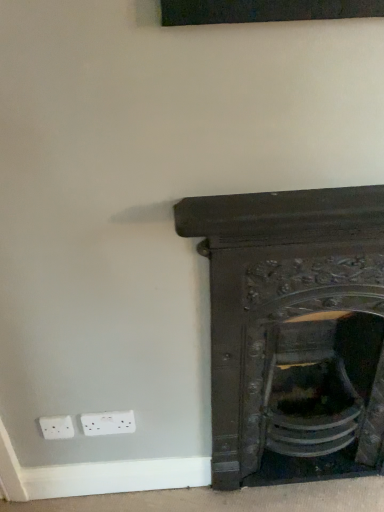
You are a GUI agent. You are given a task and a screenshot of the screen. Output one action in this format:
    pyautogui.click(x=<x>, y=<y>)
    Task: Click on the white plastic electric outlet at lower left
    The image size is (384, 512).
    Given the screenshot: What is the action you would take?
    pyautogui.click(x=108, y=423)

What do you see at coordinates (108, 423) in the screenshot? I see `white plastic electric outlet at lower left` at bounding box center [108, 423].

At what (x,y) coordinates should I click in order to perform the action: click on dark wood fireplace at lower right. Please return your answer as a coordinate pair (x, y). The image size is (384, 512). Looking at the image, I should click on (293, 331).

In order to face dark wood fireplace at lower right, should I rotate leftwards or rightwards?

A 15.971 degree turn to the right will do.

The width and height of the screenshot is (384, 512). What do you see at coordinates (293, 331) in the screenshot? I see `dark wood fireplace at lower right` at bounding box center [293, 331].

This screenshot has height=512, width=384. Identify the location of white plastic electric outlet at lower left. (108, 423).

Considering the positions of objects dark wood fireplace at lower right and white plastic electric outlet at lower left in the image provided, who is more to the right, dark wood fireplace at lower right or white plastic electric outlet at lower left?

Positioned to the right is dark wood fireplace at lower right.

Which object is further away from the camera taking this photo, dark wood fireplace at lower right or white plastic electric outlet at lower left?

white plastic electric outlet at lower left.

Considering the points (333, 292) and (110, 417), which point is in front, point (333, 292) or point (110, 417)?

The point (333, 292) is more forward.

From the image's perspective, would you say dark wood fireplace at lower right is shown under white plastic electric outlet at lower left?

Actually, dark wood fireplace at lower right appears above white plastic electric outlet at lower left in the image.

From a real-world perspective, relative to white plastic electric outlet at lower left, is dark wood fireplace at lower right vertically above or below?

In terms of real-world spatial position, dark wood fireplace at lower right is above white plastic electric outlet at lower left.

Is dark wood fireplace at lower right wider or thinner than white plastic electric outlet at lower left?

Clearly, dark wood fireplace at lower right has more width compared to white plastic electric outlet at lower left.

Is dark wood fireplace at lower right taller than white plastic electric outlet at lower left?

Indeed, dark wood fireplace at lower right has a greater height compared to white plastic electric outlet at lower left.

Considering the relative sizes of dark wood fireplace at lower right and white plastic electric outlet at lower left in the image provided, is dark wood fireplace at lower right bigger than white plastic electric outlet at lower left?

Yes, dark wood fireplace at lower right is bigger than white plastic electric outlet at lower left.

Based on the photo, is dark wood fireplace at lower right situated inside white plastic electric outlet at lower left or outside?

dark wood fireplace at lower right is not inside white plastic electric outlet at lower left, it's outside.

Is dark wood fireplace at lower right beside white plastic electric outlet at lower left?

No, dark wood fireplace at lower right is not in contact with white plastic electric outlet at lower left.

Is dark wood fireplace at lower right aimed at white plastic electric outlet at lower left?

No, dark wood fireplace at lower right is not turned towards white plastic electric outlet at lower left.

Can you tell me how much dark wood fireplace at lower right and white plastic electric outlet at lower left differ in facing direction?

dark wood fireplace at lower right and white plastic electric outlet at lower left are facing 2.58 degrees away from each other.

Where is `electric outlet located underneath the dark wood fireplace at lower right (from a real-world perspective)`? The height and width of the screenshot is (512, 384). electric outlet located underneath the dark wood fireplace at lower right (from a real-world perspective) is located at coordinates (108, 423).

Which object is positioned more to the right, white plastic electric outlet at lower left or dark wood fireplace at lower right?

From the viewer's perspective, dark wood fireplace at lower right appears more on the right side.

Is the depth of white plastic electric outlet at lower left less than that of dark wood fireplace at lower right?

No, the depth of white plastic electric outlet at lower left is greater than that of dark wood fireplace at lower right.

Which point is more distant from viewer, [133,415] or [375,219]?

The point [133,415] is behind.

From the image's perspective, which one is positioned higher, white plastic electric outlet at lower left or dark wood fireplace at lower right?

dark wood fireplace at lower right appears higher in the image.

From a real-world perspective, is white plastic electric outlet at lower left positioned over dark wood fireplace at lower right based on gravity?

No.

Looking at this image, which of these two, white plastic electric outlet at lower left or dark wood fireplace at lower right, is wider?

With larger width is dark wood fireplace at lower right.

Which of these two, white plastic electric outlet at lower left or dark wood fireplace at lower right, stands shorter?

white plastic electric outlet at lower left.

Who is bigger, white plastic electric outlet at lower left or dark wood fireplace at lower right?

Bigger between the two is dark wood fireplace at lower right.

Which is correct: white plastic electric outlet at lower left is inside dark wood fireplace at lower right, or outside of it?

The correct answer is: outside.

Based on the photo, is white plastic electric outlet at lower left not close to dark wood fireplace at lower right?

No, white plastic electric outlet at lower left is not far away from dark wood fireplace at lower right.

Is white plastic electric outlet at lower left positioned with its back to dark wood fireplace at lower right?

No.

How many degrees apart are the facing directions of white plastic electric outlet at lower left and dark wood fireplace at lower right?

2.58 degrees separate the facing orientations of white plastic electric outlet at lower left and dark wood fireplace at lower right.

You are a GUI agent. You are given a task and a screenshot of the screen. Output one action in this format:
    pyautogui.click(x=<x>, y=<y>)
    Task: Click on the electric outlet below the dark wood fireplace at lower right (from the image's perspective)
    The width and height of the screenshot is (384, 512).
    Given the screenshot: What is the action you would take?
    pyautogui.click(x=108, y=423)

The width and height of the screenshot is (384, 512). Identify the location of fireplace above the white plastic electric outlet at lower left (from the image's perspective). (293, 331).

This screenshot has height=512, width=384. What are the coordinates of `fireplace on the right side of white plastic electric outlet at lower left` in the screenshot? It's located at (293, 331).